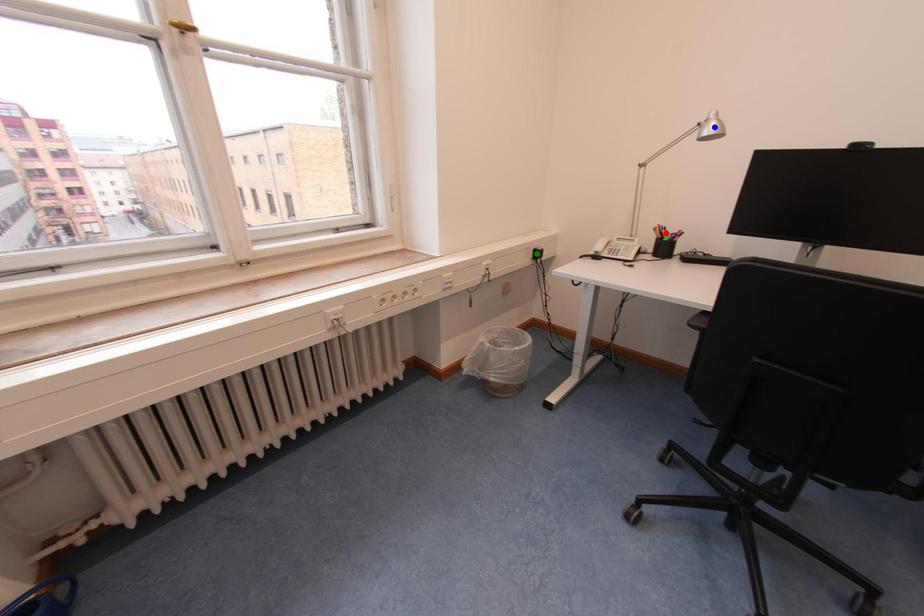
From the picture: Order these from farthest to nearest:
- blue point
- red point
- green point

1. green point
2. red point
3. blue point